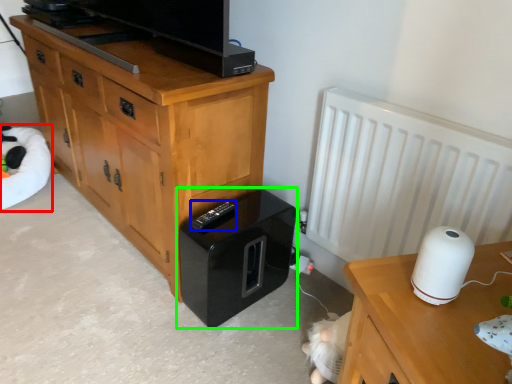
Question: Which object is positioned farthest from bean bag chair (highlighted by a red box)? Select from remote (highlighted by a blue box) and home appliance (highlighted by a green box).

Choices:
 (A) remote
 (B) home appliance

Answer: (A)